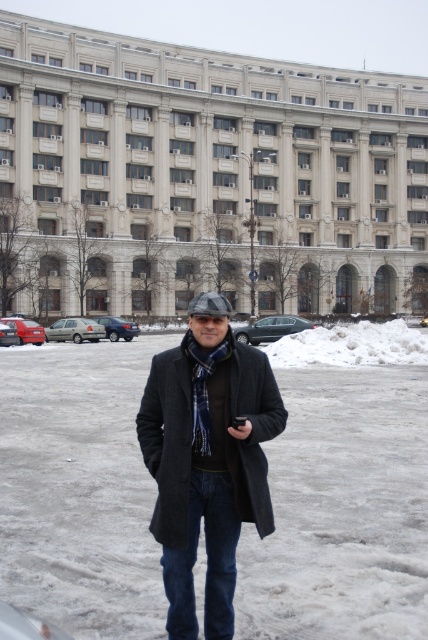
You are a photographer trying to capture a closeup shot of the blue plaid scarf at center and the yellow plastic car at center. Which object should you zoom in on to ensure both are in focus without moving the camera?

You should zoom in on the blue plaid scarf at center because it is smaller in size compared to the yellow plastic car at center, allowing both to fit within the frame when focused properly.

You are standing in the snowy urban environment shown in the image. You notice two points marked at coordinates point (x=59, y=317) and point (x=427, y=321). Which point is closer to you?

Point (x=59, y=317) is closer to you because it is further to the viewer than point (x=427, y=321).

You are a photographer trying to capture both the blue plaid scarf at center and the yellow plastic car at center in the same frame. Based on their sizes, which object should you focus on first to ensure both fit in the shot?

The blue plaid scarf at center is shorter than the yellow plastic car at center, so you should focus on framing the yellow plastic car at center first since it takes up more vertical space, ensuring there is enough room for the smaller scarf.